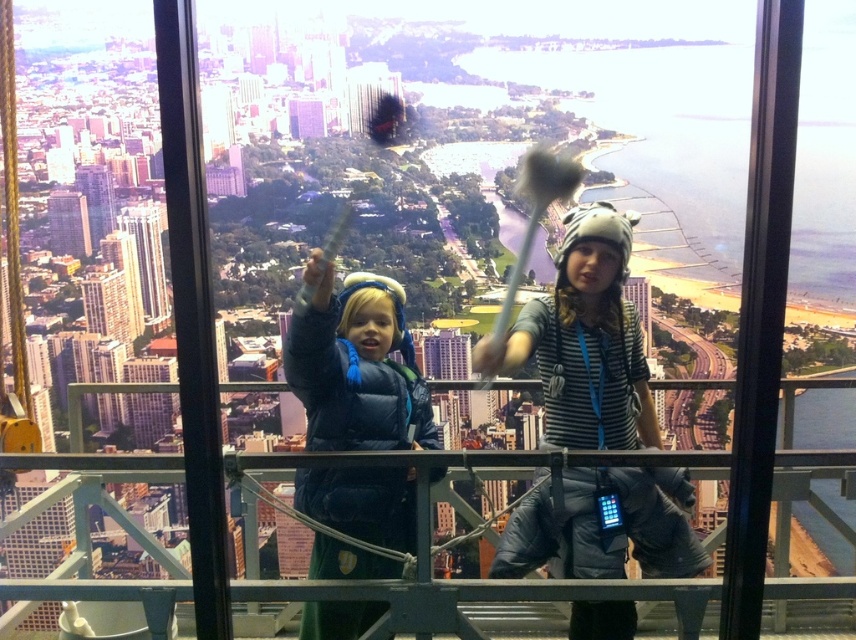
Between matte blue jacket at center and matte gray building at left, which one appears on the right side from the viewer's perspective?

From the viewer's perspective, matte blue jacket at center appears more on the right side.

Can you confirm if matte blue jacket at center is positioned to the right of matte gray building at left?

Yes, matte blue jacket at center is to the right of matte gray building at left.

Between point (308, 611) and point (128, 225), which one is positioned behind?

Point (128, 225)

Where is `matte blue jacket at center`? The width and height of the screenshot is (856, 640). matte blue jacket at center is located at coordinates (355, 365).

Between matte blue jacket at center and smooth glass skyscraper at center, which one has less height?

With less height is smooth glass skyscraper at center.

Does matte blue jacket at center appear over smooth glass skyscraper at center?

No.

The image size is (856, 640). Find the location of `matte blue jacket at center`. matte blue jacket at center is located at coordinates (355, 365).

The height and width of the screenshot is (640, 856). I want to click on matte blue jacket at center, so click(355, 365).

Is matte gray building at left smaller than smooth glass skyscraper at center?

Incorrect, matte gray building at left is not smaller in size than smooth glass skyscraper at center.

Between matte gray building at left and smooth glass skyscraper at center, which one has more height?

Result: Standing taller between the two is matte gray building at left.

The image size is (856, 640). Describe the element at coordinates (147, 257) in the screenshot. I see `matte gray building at left` at that location.

At what (x,y) coordinates should I click in order to perform the action: click on matte gray building at left. Please return your answer as a coordinate pair (x, y). This screenshot has width=856, height=640. Looking at the image, I should click on (147, 257).